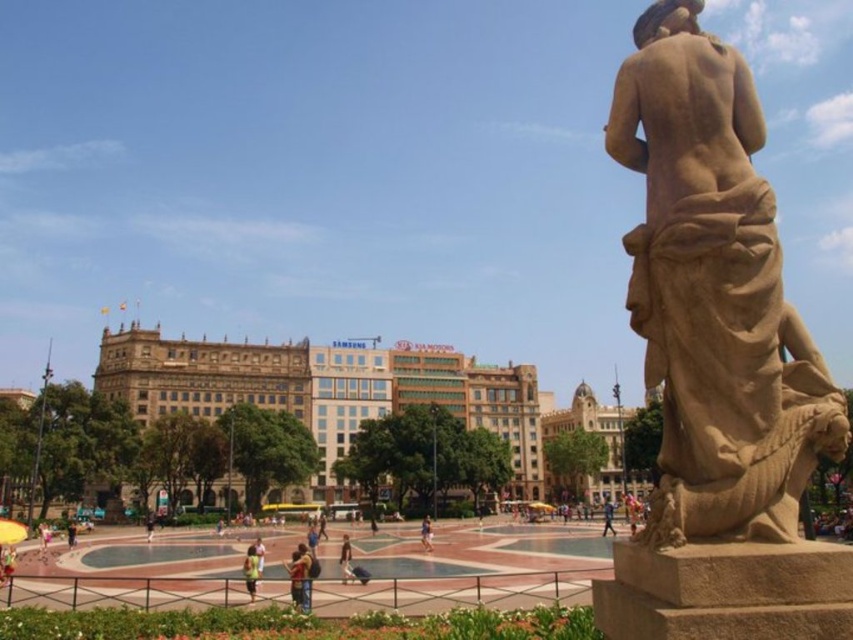
Question: Is light brown statue at center to the right of light brown fabric dress at lower left from the viewer's perspective?

Choices:
 (A) no
 (B) yes

Answer: (B)

Question: Among these objects, which one is nearest to the camera?

Choices:
 (A) light brown fabric person at center
 (B) yellow fabric bag at lower center

Answer: (B)

Question: Among these objects, which one is nearest to the camera?

Choices:
 (A) brown stone statue at right
 (B) denim jeans at lower center
 (C) light brown fabric dress at lower left

Answer: (A)

Question: Does yellow fabric bag at lower center lie in front of light brown leather jacket at lower center?

Choices:
 (A) yes
 (B) no

Answer: (A)

Question: Does brown stone statue at right appear on the left side of yellow fabric bag at lower center?

Choices:
 (A) no
 (B) yes

Answer: (A)

Question: Which object appears closest to the camera in this image?

Choices:
 (A) light brown fabric person at center
 (B) orange fabric bag at lower center
 (C) denim jeans at lower center

Answer: (C)